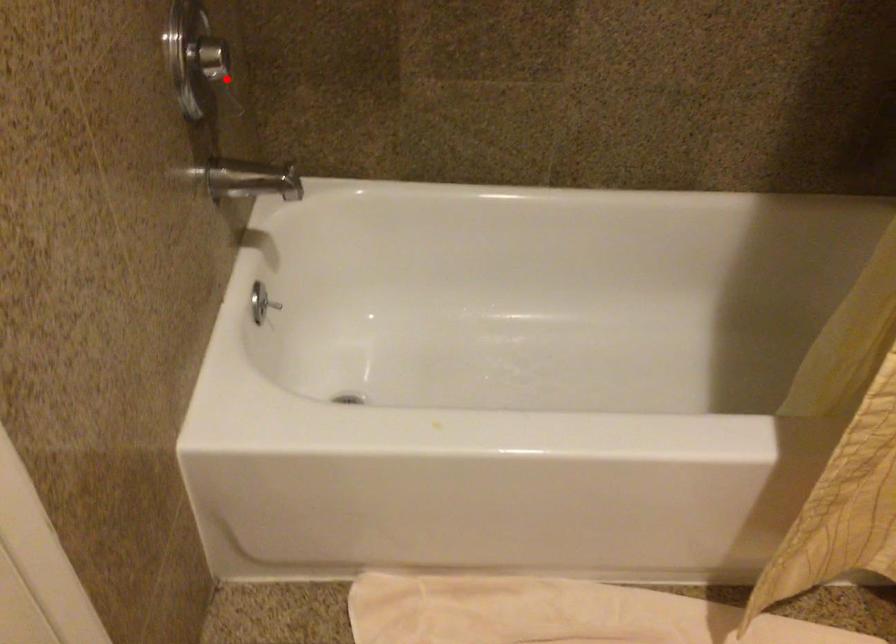
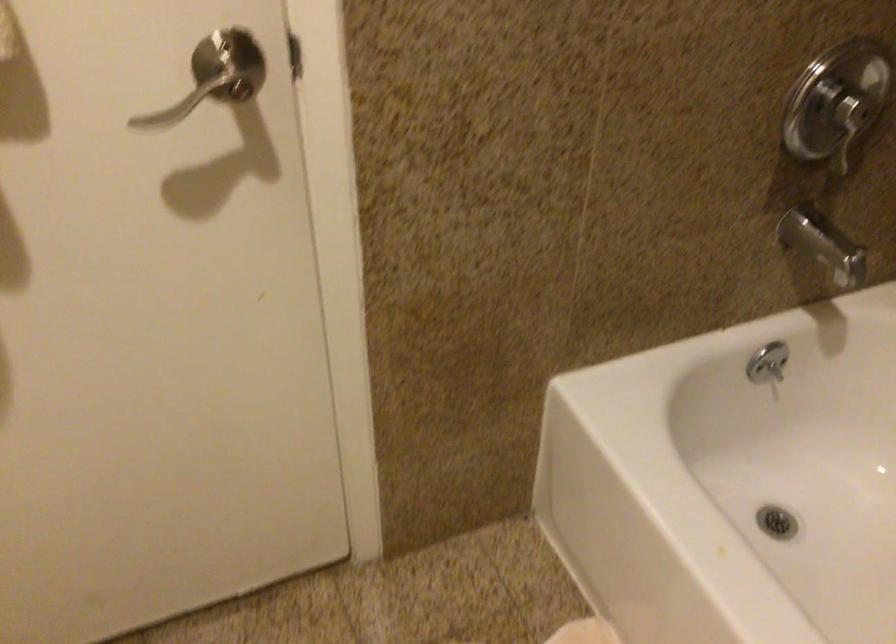
Question: I am providing you with two images of the same scene from different viewpoints. Image1 has a red point marked. In image2, the corresponding 3D location appears at what relative position? Reply with the corresponding letter.

Choices:
 (A) Closer
 (B) Farther

Answer: (A)